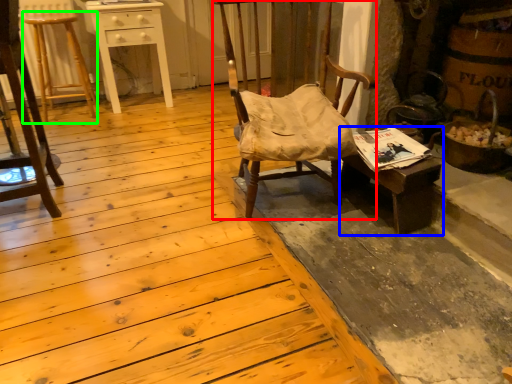
Question: Considering the real-world distances, which object is farthest from chair (highlighted by a red box)? desk (highlighted by a blue box) or bar stool (highlighted by a green box)?

Choices:
 (A) desk
 (B) bar stool

Answer: (B)